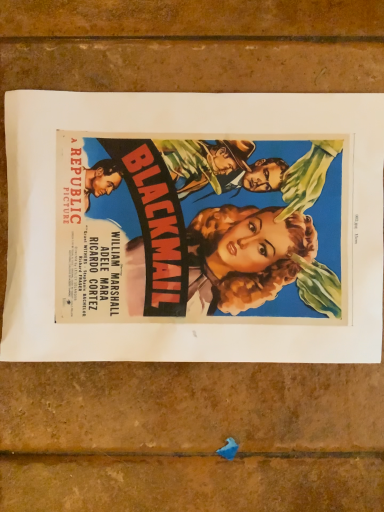
This screenshot has height=512, width=384. What are the coordinates of `blank space situated above matte paper poster at center (from a real-world perspective)` in the screenshot? It's located at (210, 221).